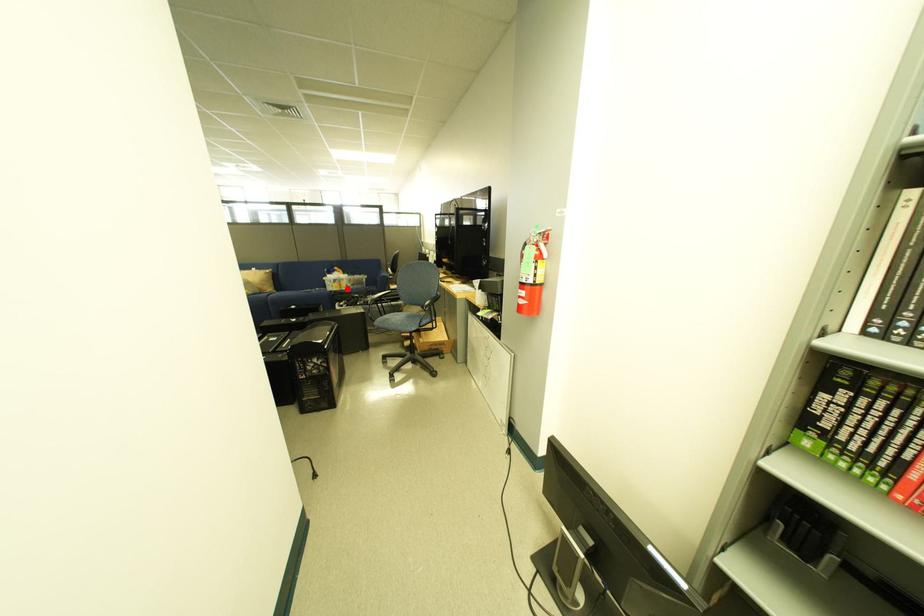
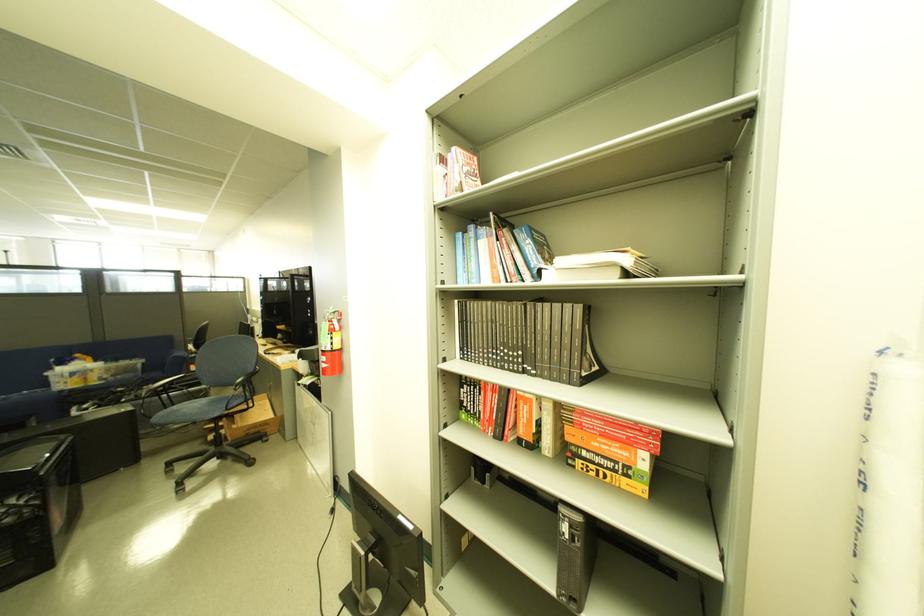
Locate, in the second image, the point that corresponds to the highlighted location in the first image.

(88, 385)